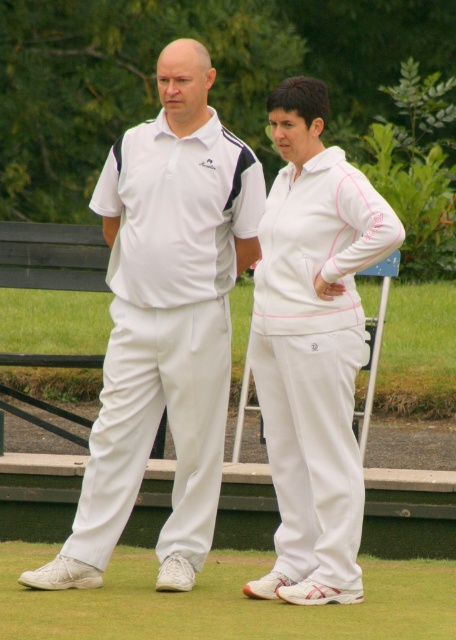
You are standing in the park and see two points marked in the image. Which point is closer to you, point (357, 352) or point (320, 618)?

Point (357, 352) is further to the viewer than point (320, 618), so point (320, 618) is closer to you.

You are taking a photo of two people standing in a park. You notice two points in the image labeled as point (130,332) and point (279,387). Which point is closer to the camera?

Point (130,332) is further to the camera than point (279,387), so point (279,387) is closer to the camera.

You are a photographer trying to capture the white matte tracksuit at center in the image. What are the coordinates where you should focus your camera?

The white matte tracksuit at center is located at coordinates point [312,348].